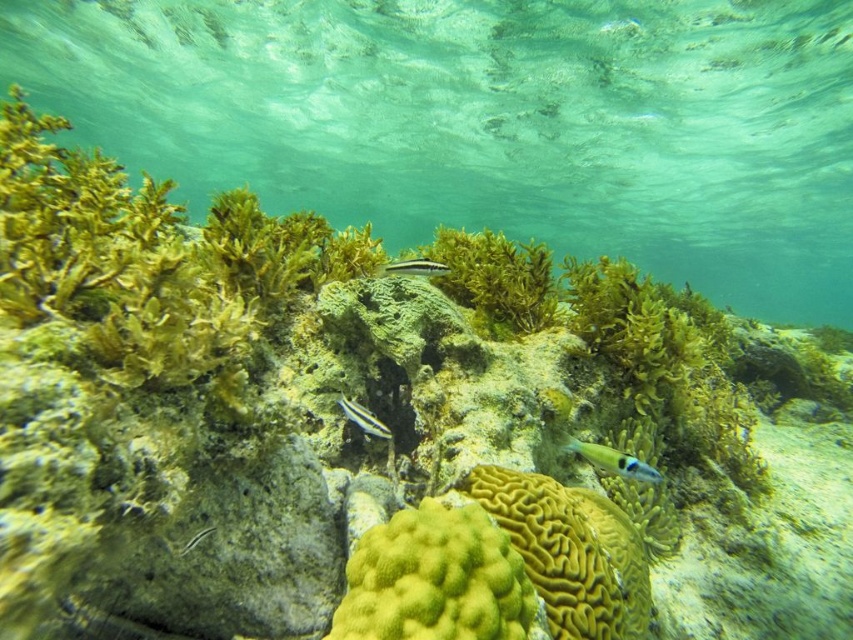
You are a marine biologist observing the underwater scene. You notice the yellow coral at center and the green matte algae at center. Which of these two organisms is larger in size?

The green matte algae at center is larger than the yellow coral at center.

You are a marine biologist analyzing an underwater image. You need to locate the clear water area for a water quality test. According to the image, where exactly is the clear water at center positioned?

The clear water at center is located at point coordinates of (489, 122).